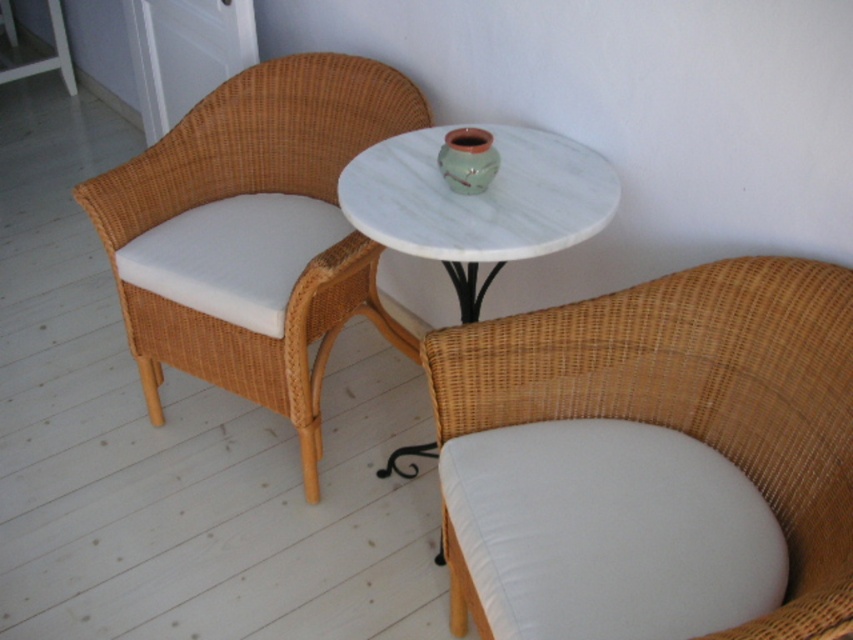
Who is taller, woven rattan armchair at left or white marble side table at center?

Standing taller between the two is woven rattan armchair at left.

Does woven rattan armchair at left lie in front of white marble side table at center?

No, it is not.

Is point (165, 177) in front of point (589, 150)?

No.

This screenshot has height=640, width=853. I want to click on woven rattan armchair at left, so click(x=257, y=230).

Which is more to the right, white marble side table at center or white marble table at center?

white marble side table at center is more to the right.

This screenshot has width=853, height=640. I want to click on white marble side table at center, so click(477, 198).

Is woven rattan armchair at center above white marble side table at center?

No, woven rattan armchair at center is not above white marble side table at center.

Between woven rattan armchair at center and white marble side table at center, which one appears on the right side from the viewer's perspective?

From the viewer's perspective, woven rattan armchair at center appears more on the right side.

Locate an element on the screen. Image resolution: width=853 pixels, height=640 pixels. woven rattan armchair at center is located at coordinates [695, 394].